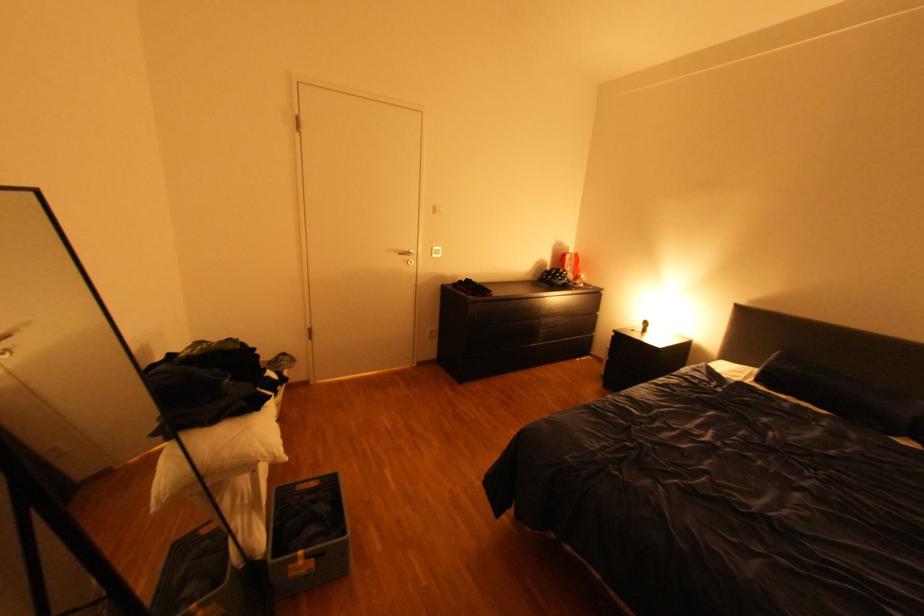
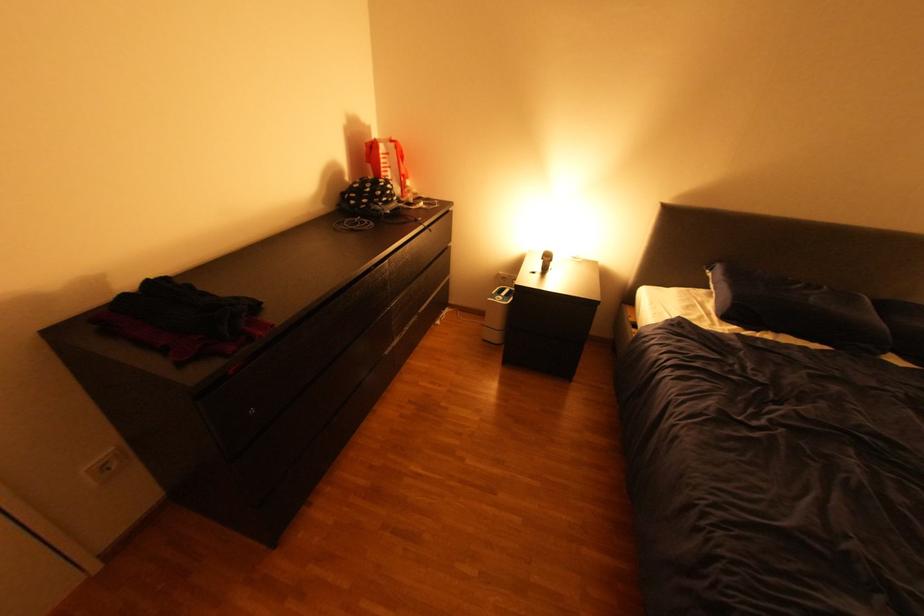
The point at (442, 331) is marked in the first image. Where is the corresponding point in the second image?

(114, 467)